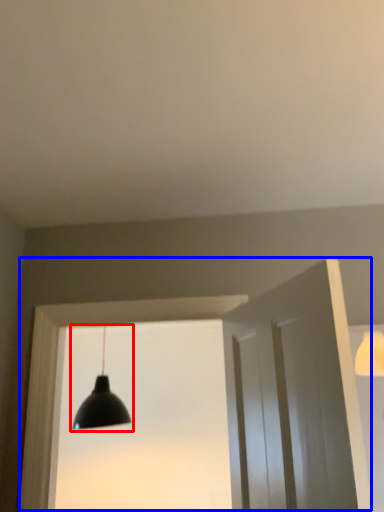
Question: Among these objects, which one is farthest to the camera, lamp (highlighted by a red box) or window frame (highlighted by a blue box)?

Choices:
 (A) lamp
 (B) window frame

Answer: (A)